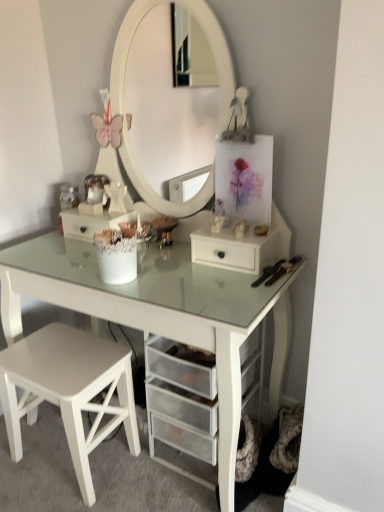
Image resolution: width=384 pixels, height=512 pixels. What are the coordinates of `vacant area on top of white matte drawer at center (from a real-world perspective)` in the screenshot? It's located at (235, 232).